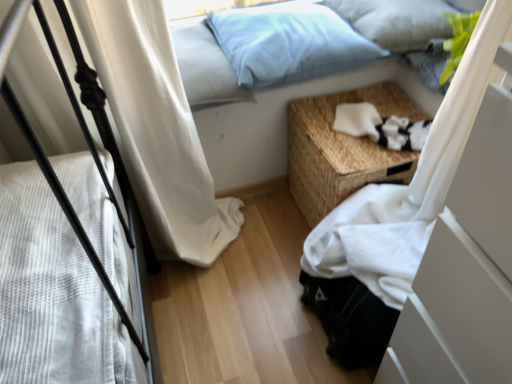
At what (x,y) coordinates should I click in order to perform the action: click on free spot above light blue fabric pillow at upper center, which is the 2th pillow in left-to-right order (from a real-world perspective). Please return your answer as a coordinate pair (x, y). Image resolution: width=512 pixels, height=384 pixels. Looking at the image, I should click on (293, 15).